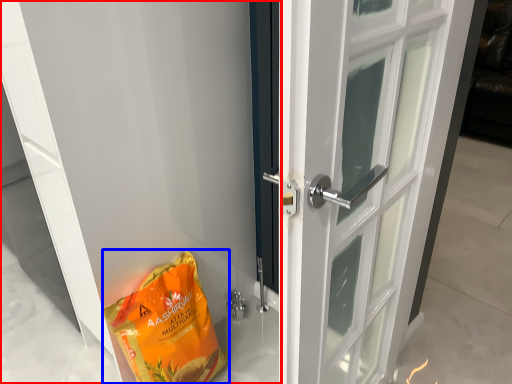
Question: Which point is further to the camera, door (highlighted by a red box) or grocery bag (highlighted by a blue box)?

Choices:
 (A) door
 (B) grocery bag

Answer: (B)